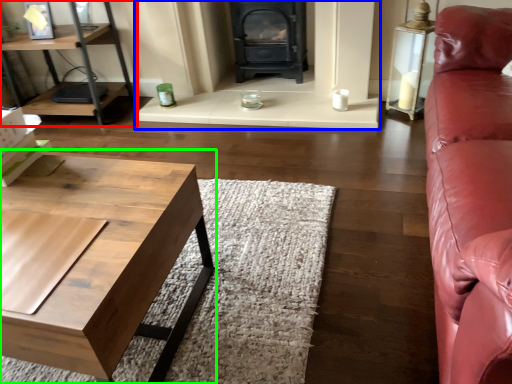
Question: Which object is the closest to the shelf (highlighted by a red box)? Choose among these: fireplace (highlighted by a blue box) or coffee table (highlighted by a green box).

Choices:
 (A) fireplace
 (B) coffee table

Answer: (A)